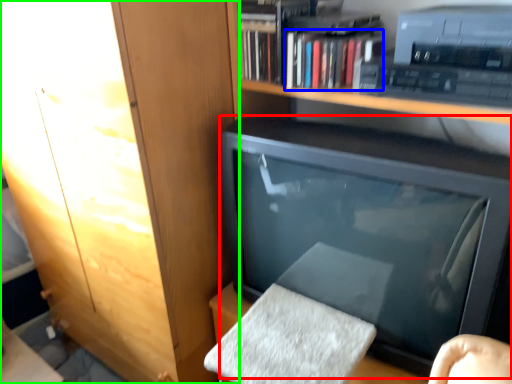
Question: Which object is the closest to the television (highlighted by a red box)? Choose among these: book (highlighted by a blue box) or cabinetry (highlighted by a green box).

Choices:
 (A) book
 (B) cabinetry

Answer: (A)